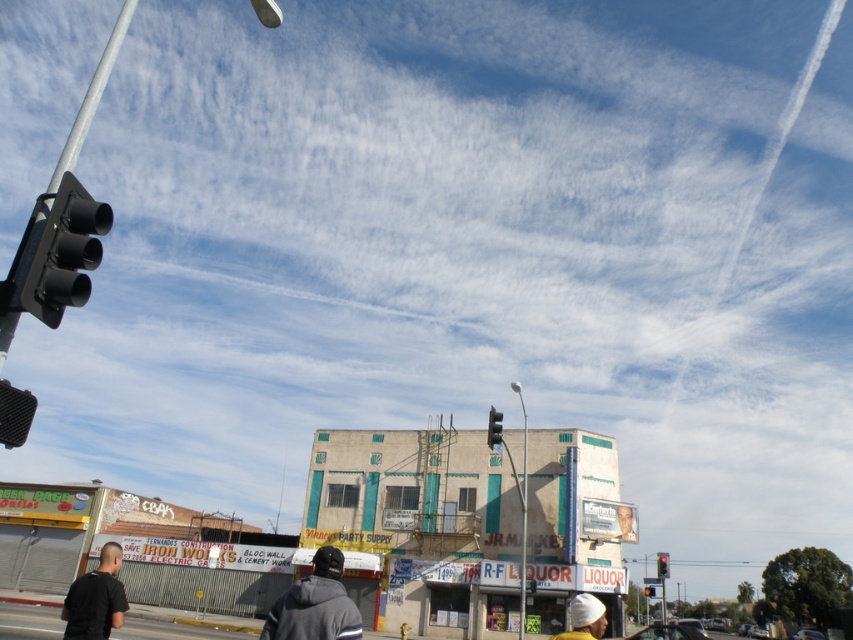
Question: Which point is closer to the camera taking this photo?

Choices:
 (A) (666, 564)
 (B) (78, 259)
 (C) (498, 429)
 (D) (643, 588)

Answer: (B)

Question: Can you confirm if matte black traffic light at left is smaller than black plastic traffic light at center?

Choices:
 (A) no
 (B) yes

Answer: (A)

Question: Which of the following is the closest to the observer?

Choices:
 (A) black plastic traffic light at center
 (B) dark gray hoodie at center

Answer: (B)

Question: Considering the relative positions of matte black traffic light at left and white knit cap at center in the image provided, where is matte black traffic light at left located with respect to white knit cap at center?

Choices:
 (A) below
 (B) above

Answer: (B)

Question: From the image, what is the correct spatial relationship of matte black traffic light at left in relation to white knit cap at center?

Choices:
 (A) right
 (B) left

Answer: (B)

Question: Based on their relative distances, which object is farther from the red glass traffic light at upper center?

Choices:
 (A) dark gray hoodie at lower left
 (B) dark gray hoodie at center
 (C) black plastic traffic light at center

Answer: (A)